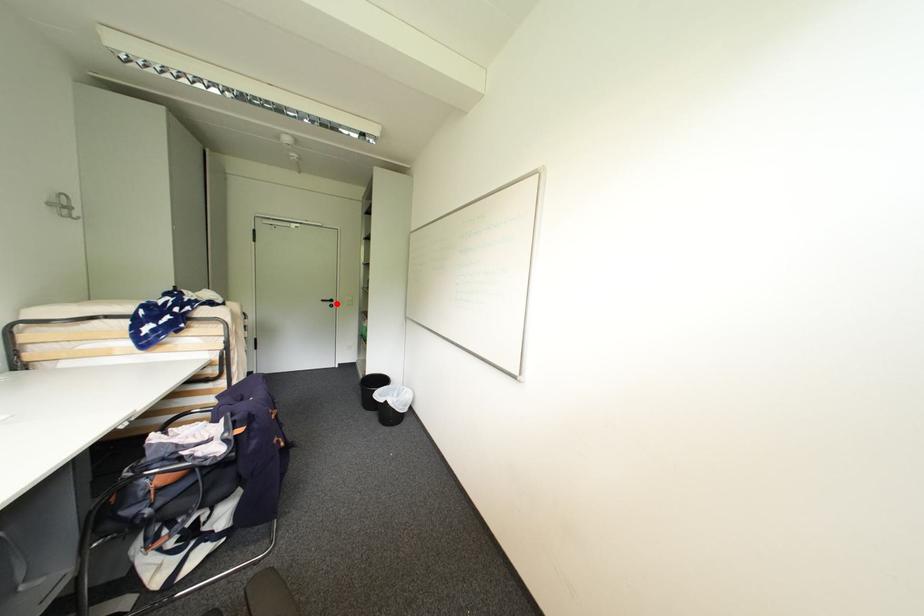
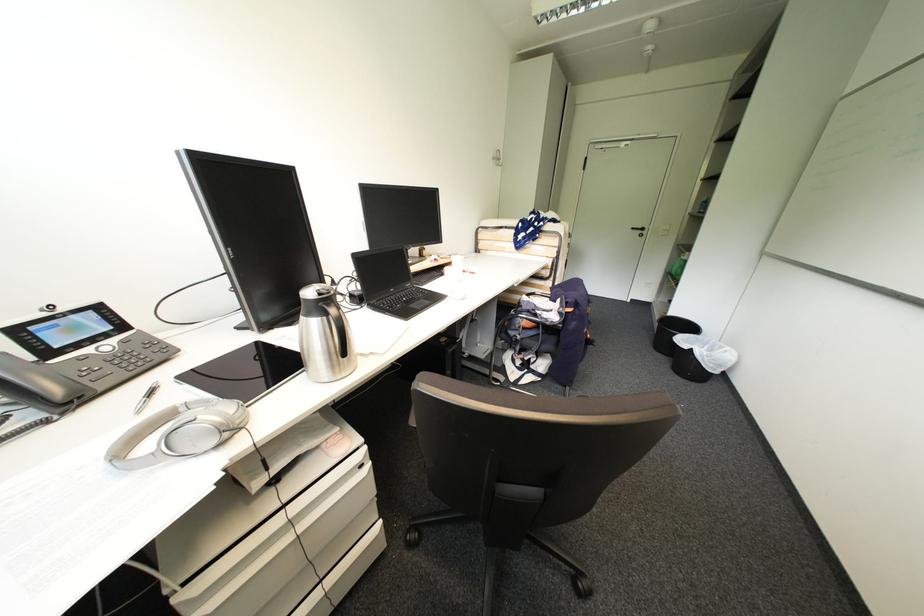
Locate, in the second image, the point that corresponds to the highlighted location in the first image.

(648, 233)